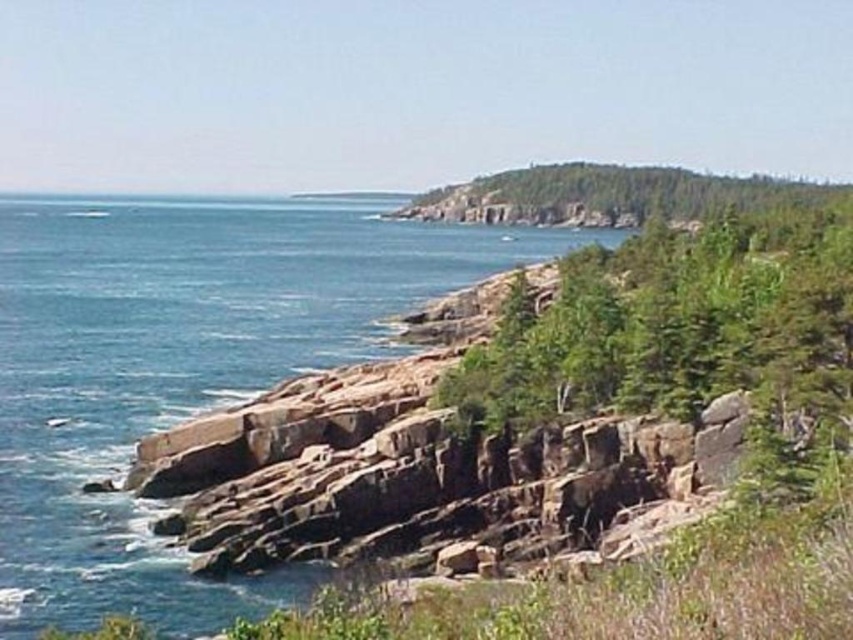
Question: Can you confirm if blue water at center is positioned to the right of green leafy hillside at upper center?

Choices:
 (A) no
 (B) yes

Answer: (A)

Question: Is blue water at center above green leafy hillside at upper center?

Choices:
 (A) yes
 (B) no

Answer: (B)

Question: Which object appears closest to the camera in this image?

Choices:
 (A) blue water at center
 (B) green leafy hillside at upper center

Answer: (A)

Question: Where is blue water at center located in relation to green leafy hillside at upper center in the image?

Choices:
 (A) right
 (B) left

Answer: (B)